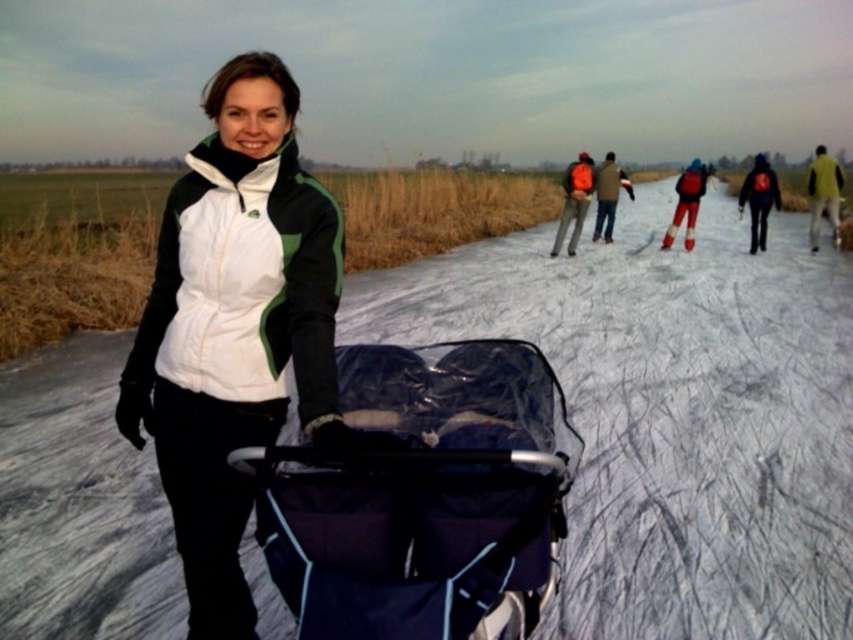
Question: Estimate the real-world distances between objects in this image. Which object is farther from the red snowsuit at center?

Choices:
 (A) yellow fabric jacket at upper right
 (B) black matte jacket at upper right
 (C) white matte snow at center
 (D) orange jacket at center

Answer: (C)

Question: Is dark blue fabric baby carriage at center further to the viewer compared to orange jacket at center?

Choices:
 (A) yes
 (B) no

Answer: (B)

Question: Which object is the closest to the dark blue fabric baby carriage at center?

Choices:
 (A) orange jacket at center
 (B) white matte snow at center

Answer: (B)

Question: Which object appears closest to the camera in this image?

Choices:
 (A) yellow fabric jacket at upper right
 (B) black matte jacket at upper right
 (C) orange jacket at center

Answer: (B)

Question: Can you confirm if dark blue fabric baby carriage at center is positioned below orange jacket at center?

Choices:
 (A) yes
 (B) no

Answer: (A)

Question: Is dark blue fabric baby carriage at center in front of yellow fabric jacket at upper right?

Choices:
 (A) yes
 (B) no

Answer: (A)